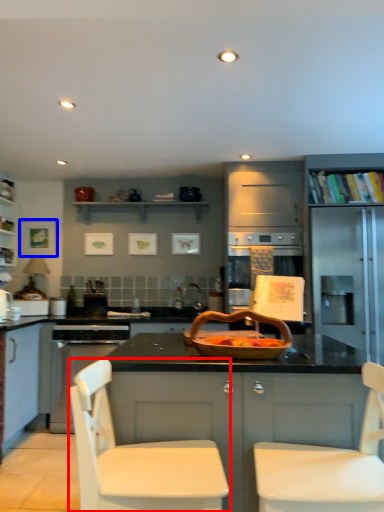
Question: Which object is closer to the camera taking this photo, chair (highlighted by a red box) or picture frame (highlighted by a blue box)?

Choices:
 (A) chair
 (B) picture frame

Answer: (A)